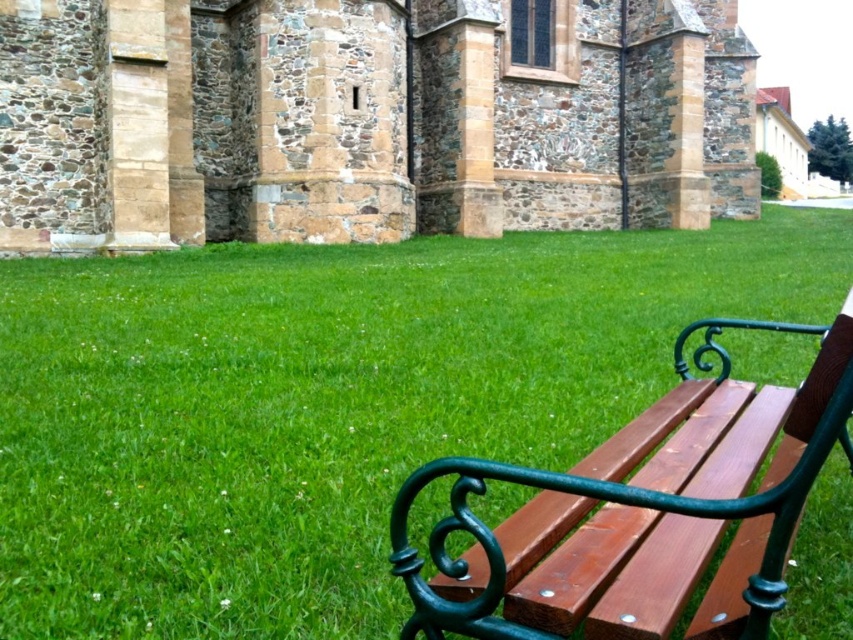
Question: Which point is farther to the camera?

Choices:
 (A) (428, 522)
 (B) (515, 540)
 (C) (54, 116)

Answer: (C)

Question: Which of the following is the closest to the observer?

Choices:
 (A) wooden bench at right
 (B) stone textured church at center
 (C) green grass at center

Answer: (A)

Question: Does green grass at center come in front of wooden bench at right?

Choices:
 (A) yes
 (B) no

Answer: (B)

Question: Does green grass at center have a larger size compared to wooden bench at right?

Choices:
 (A) no
 (B) yes

Answer: (B)

Question: Where is stone textured church at center located in relation to wooden bench at right in the image?

Choices:
 (A) left
 (B) right

Answer: (A)

Question: Which of the following is the farthest from the observer?

Choices:
 (A) (805, 449)
 (B) (587, 184)

Answer: (B)